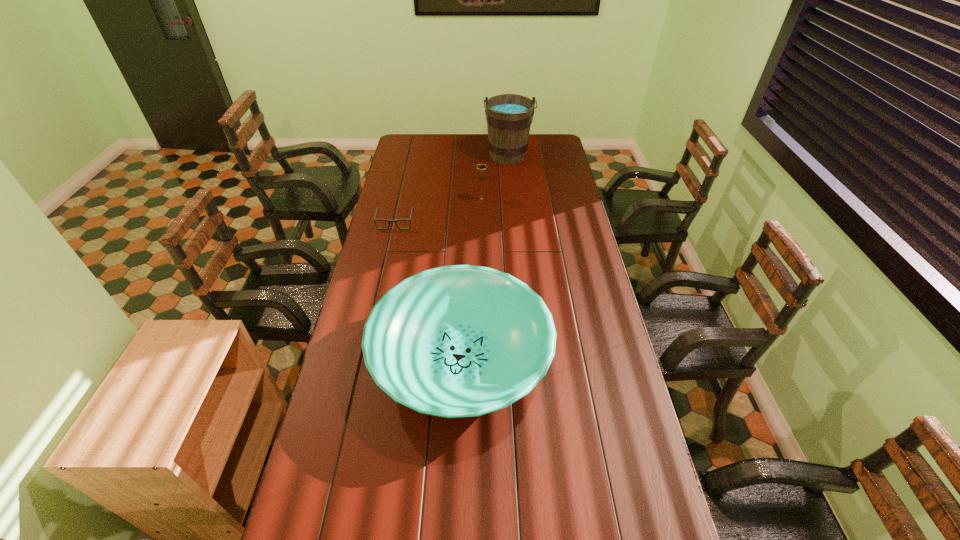
Find the location of a particular element. empty space that is in between the third tallest object and the farthest object is located at coordinates (484, 256).

Where is `vacant space that is in between the shortest object and the chalice`? The height and width of the screenshot is (540, 960). vacant space that is in between the shortest object and the chalice is located at coordinates (439, 211).

What are the coordinates of `blank region between the wine bucket and the spectacles` in the screenshot? It's located at (451, 190).

Find the location of `empty space that is in between the tallest object and the dish`. empty space that is in between the tallest object and the dish is located at coordinates (484, 256).

The width and height of the screenshot is (960, 540). What are the coordinates of `object that ranks as the second closest to the farthest object` in the screenshot? It's located at (389, 221).

Locate an element on the screen. The height and width of the screenshot is (540, 960). object that ranks as the third closest to the third shortest object is located at coordinates (455, 341).